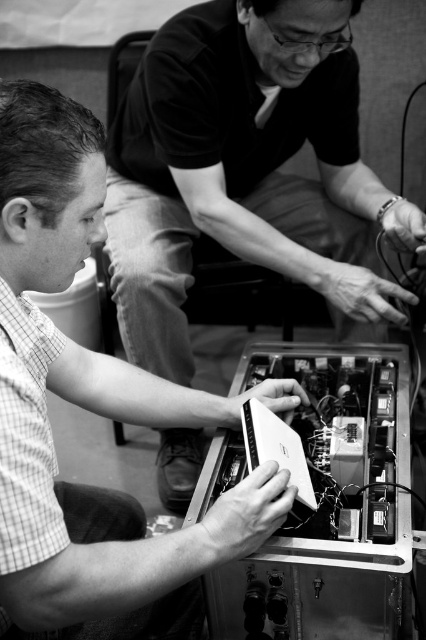
Question: Where is metallic circuit board at center located in relation to matte white laptop at lower center in the image?

Choices:
 (A) below
 (B) above

Answer: (B)

Question: Does metallic circuit board at center have a smaller size compared to matte white laptop at lower center?

Choices:
 (A) no
 (B) yes

Answer: (A)

Question: Which object appears closest to the camera in this image?

Choices:
 (A) metallic circuit board at center
 (B) matte white laptop at lower center

Answer: (B)

Question: Does metallic circuit board at center appear on the left side of matte white laptop at lower center?

Choices:
 (A) no
 (B) yes

Answer: (A)